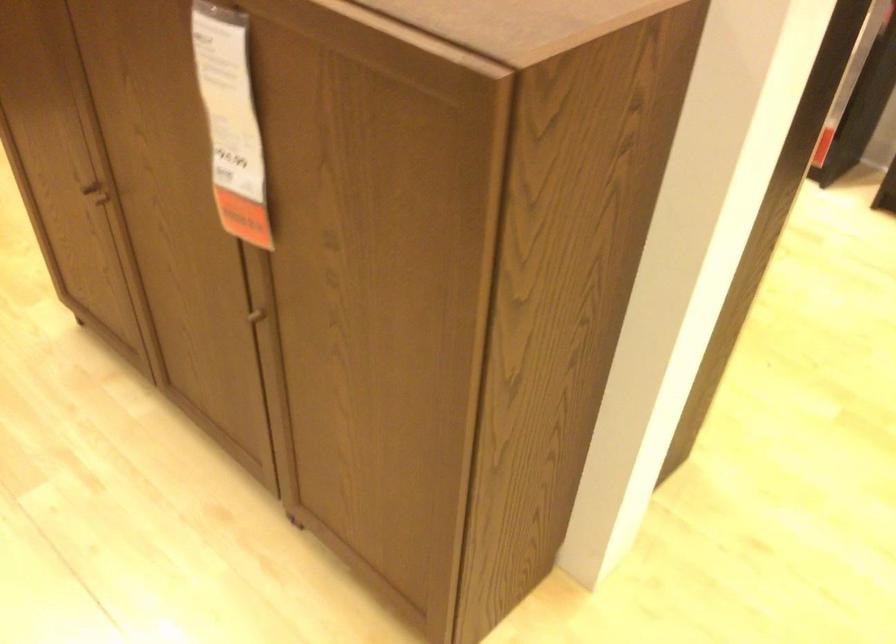
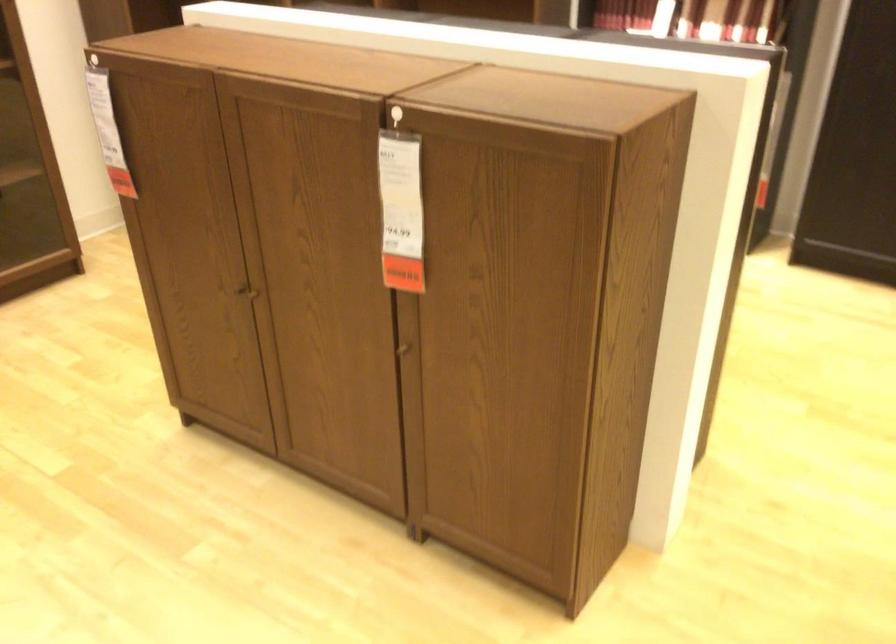
Question: The first image is from the beginning of the video and the second image is from the end. How did the camera likely rotate when shooting the video?

Choices:
 (A) Left
 (B) Right
 (C) Up
 (D) Down

Answer: (C)